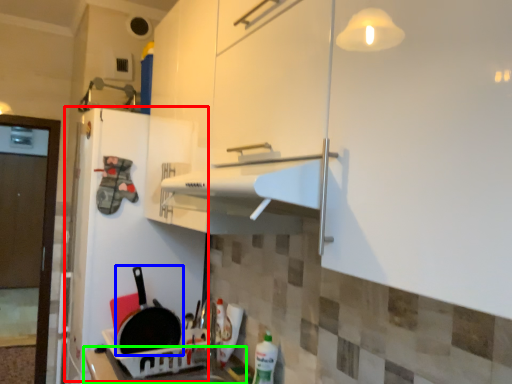
Question: Considering the real-world distances, which object is closest to fridge (highlighted by a red box)? frying pan (highlighted by a blue box) or counter top (highlighted by a green box).

Choices:
 (A) frying pan
 (B) counter top

Answer: (A)